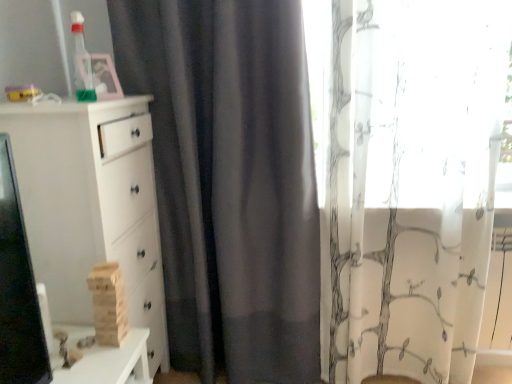
Question: Are transparent plastic bottle at upper left, which is the first toy from left to right, and white sheer curtain at right beside each other?

Choices:
 (A) no
 (B) yes

Answer: (A)

Question: Is transparent plastic bottle at upper left, arranged as the first toy when viewed from the top, at the left side of white sheer curtain at right?

Choices:
 (A) no
 (B) yes

Answer: (B)

Question: From the image's perspective, is transparent plastic bottle at upper left, which is counted as the 2th toy, starting from the bottom, above white sheer curtain at right?

Choices:
 (A) yes
 (B) no

Answer: (A)

Question: Is transparent plastic bottle at upper left, which is counted as the 2th toy, starting from the bottom, positioned with its back to white sheer curtain at right?

Choices:
 (A) no
 (B) yes

Answer: (A)

Question: Can you confirm if transparent plastic bottle at upper left, which ranks as the second toy in right-to-left order, is smaller than white sheer curtain at right?

Choices:
 (A) yes
 (B) no

Answer: (A)

Question: Does transparent plastic bottle at upper left, which is the first toy from left to right, have a greater width compared to white sheer curtain at right?

Choices:
 (A) no
 (B) yes

Answer: (A)

Question: Can you confirm if white matte chest of drawers at left is wider than wooden blocks at left, the 2th toy positioned from the top?

Choices:
 (A) no
 (B) yes

Answer: (B)

Question: From the image's perspective, would you say white matte chest of drawers at left is positioned over wooden blocks at left, which is the first toy from right to left?

Choices:
 (A) yes
 (B) no

Answer: (A)

Question: Would you say white matte chest of drawers at left is a long distance from wooden blocks at left, which is the 1th toy from bottom to top?

Choices:
 (A) yes
 (B) no

Answer: (B)

Question: Is white matte chest of drawers at left outside of wooden blocks at left, which is the second toy in left-to-right order?

Choices:
 (A) yes
 (B) no

Answer: (A)

Question: Considering the relative positions of white matte chest of drawers at left and wooden blocks at left, which is the first toy from right to left, in the image provided, is white matte chest of drawers at left in front of wooden blocks at left, which is the first toy from right to left,?

Choices:
 (A) no
 (B) yes

Answer: (B)

Question: Is white matte chest of drawers at left at the right side of wooden blocks at left, which is the 1th toy from bottom to top?

Choices:
 (A) yes
 (B) no

Answer: (B)

Question: From a real-world perspective, is transparent plastic bottle at upper left, which is the first toy from left to right, beneath white matte chest of drawers at left?

Choices:
 (A) no
 (B) yes

Answer: (A)